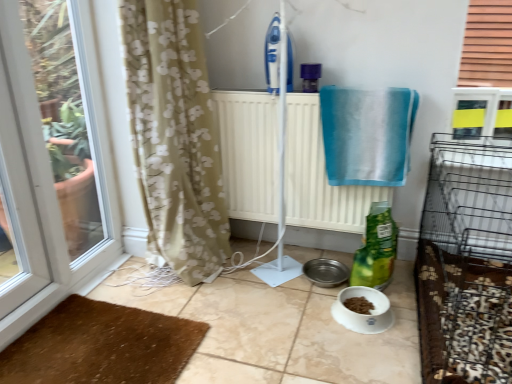
Question: From the image's perspective, is brown textured mat at lower left located above or below transparent glass window at left?

Choices:
 (A) above
 (B) below

Answer: (B)

Question: Is point (138, 362) closer or farther from the camera than point (47, 54)?

Choices:
 (A) farther
 (B) closer

Answer: (B)

Question: Based on their relative distances, which object is farther from the brown textured mat at lower left?

Choices:
 (A) white radiator at center
 (B) transparent glass window at left
 (C) blue fabric towel at upper right
 (D) green matte bag at lower center

Answer: (C)

Question: Which object is positioned closest to the transparent glass window at left?

Choices:
 (A) blue fabric towel at upper right
 (B) green matte bag at lower center
 (C) white radiator at center
 (D) brown textured mat at lower left

Answer: (D)